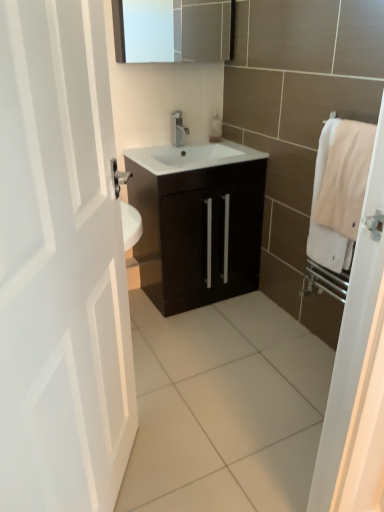
Question: Looking at their shapes, would you say dark wood cabinet at center is wider or thinner than white matte door at left?

Choices:
 (A) thin
 (B) wide

Answer: (B)

Question: From the image's perspective, is dark wood cabinet at center positioned above or below white matte door at left?

Choices:
 (A) above
 (B) below

Answer: (A)

Question: Considering the real-world distances, which object is farthest from the white cotton bath towel at right?

Choices:
 (A) satin nickel faucet at center
 (B) matte silver medicine cabinet at upper center
 (C) translucent plastic soap dispenser at center
 (D) dark wood cabinet at center
 (E) white matte door at left

Answer: (B)

Question: Estimate the real-world distances between objects in this image. Which object is closer to the white cotton bath towel at right?

Choices:
 (A) dark wood cabinet at center
 (B) translucent plastic soap dispenser at center
 (C) white matte door at left
 (D) matte silver medicine cabinet at upper center
 (E) satin nickel faucet at center

Answer: (A)